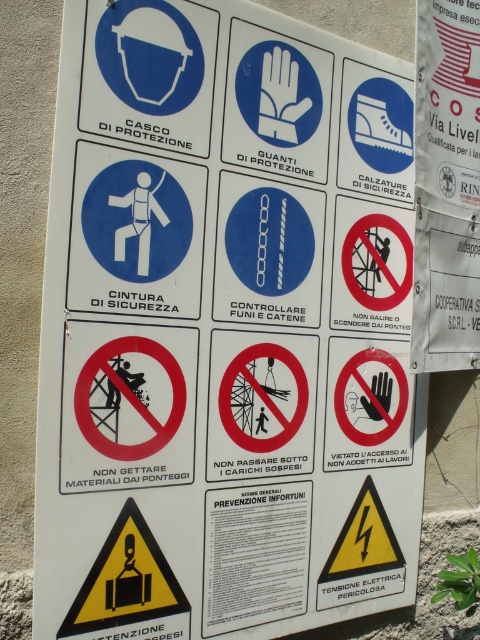
Question: Which of the following is the farthest from the observer?

Choices:
 (A) (164, 460)
 (B) (178, 230)
 (C) (218, 188)

Answer: (C)

Question: Which object appears farthest from the camera in this image?

Choices:
 (A) blue plastic helmet at upper left
 (B) red circle sign at center

Answer: (B)

Question: Among these points, which one is farthest from the camera?

Choices:
 (A) (324, 212)
 (B) (72, 381)
 (C) (153, 246)
 (D) (202, 88)

Answer: (A)

Question: Is the position of red circle sign at center more distant than that of blue plastic helmet at upper left?

Choices:
 (A) no
 (B) yes

Answer: (B)

Question: Does blue matte safety harness at center appear over blue glossy chain at center?

Choices:
 (A) no
 (B) yes

Answer: (B)

Question: Does blue matte safety harness at center have a greater width compared to blue glossy chain at center?

Choices:
 (A) yes
 (B) no

Answer: (A)